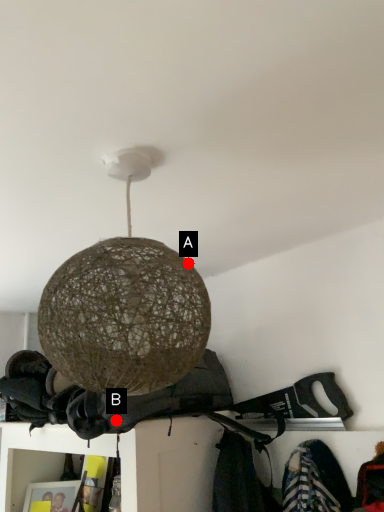
Question: Two points are circled on the image, labeled by A and B beside each circle. Which point is further to the camera?

Choices:
 (A) A is further
 (B) B is further

Answer: (A)